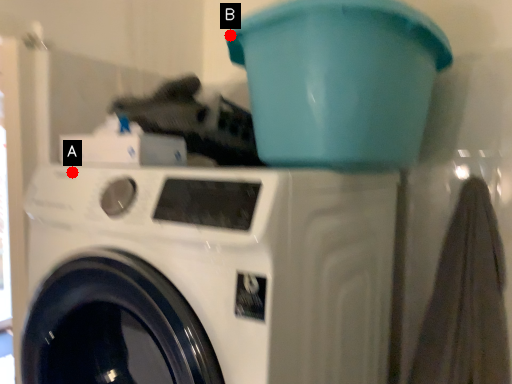
Question: Two points are circled on the image, labeled by A and B beside each circle. Among these points, which one is farthest from the camera?

Choices:
 (A) A is further
 (B) B is further

Answer: (B)